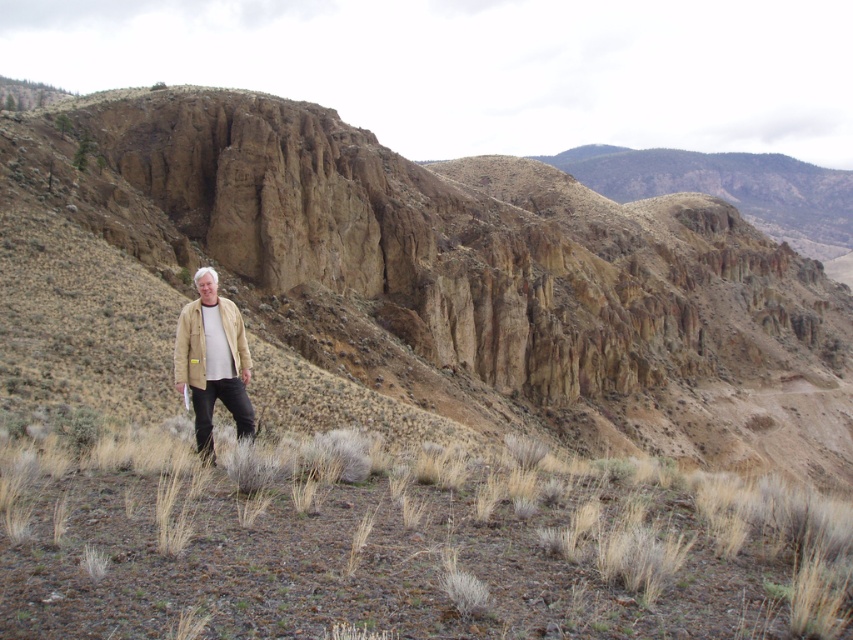
You are standing at the base of the cliff and want to reach the top. There are two points marked on the cliff face. Which point is closer to you, point (x=181, y=336) or point (x=233, y=364)?

Point (x=181, y=336) is closer to the viewer than point (x=233, y=364), so you should aim for point (x=181, y=336) first as it is nearer to your current position at the base of the cliff.